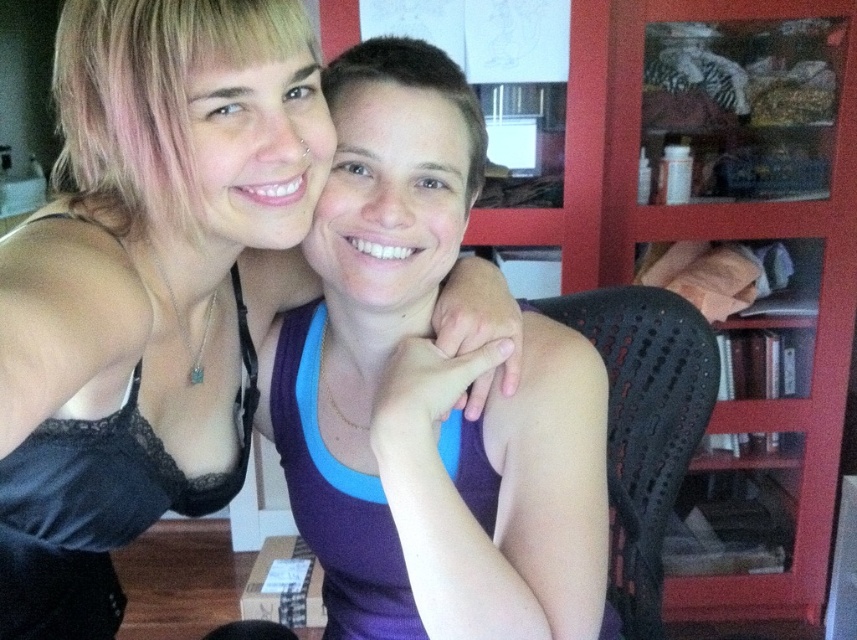
Is black lace tank top at upper left above purple fabric tank top at center?

Correct, black lace tank top at upper left is located above purple fabric tank top at center.

The width and height of the screenshot is (857, 640). I want to click on black lace tank top at upper left, so click(x=148, y=285).

Describe the element at coordinates (148, 285) in the screenshot. The image size is (857, 640). I see `black lace tank top at upper left` at that location.

At what (x,y) coordinates should I click in order to perform the action: click on black lace tank top at upper left. Please return your answer as a coordinate pair (x, y). The height and width of the screenshot is (640, 857). Looking at the image, I should click on (148, 285).